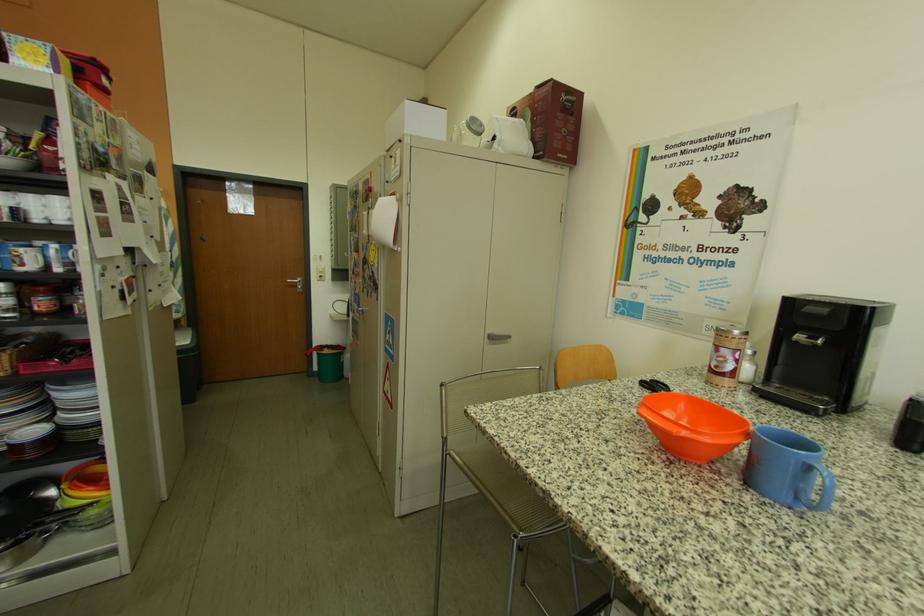
The image size is (924, 616). Describe the element at coordinates (296, 283) in the screenshot. I see `the metal door handle` at that location.